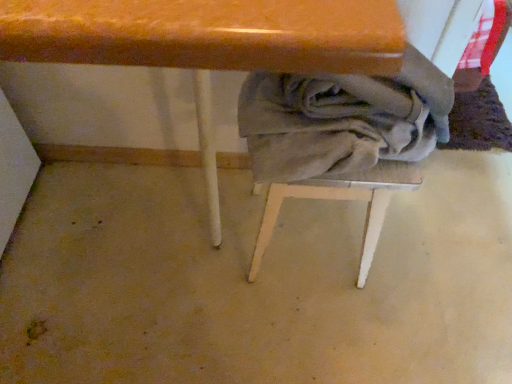
Question: Does gray cotton laundry at lower center have a larger size compared to wooden table at center?

Choices:
 (A) no
 (B) yes

Answer: (A)

Question: Is gray cotton laundry at lower center not close to wooden table at center?

Choices:
 (A) yes
 (B) no

Answer: (B)

Question: Can you confirm if gray cotton laundry at lower center is smaller than wooden table at center?

Choices:
 (A) no
 (B) yes

Answer: (B)

Question: Can you confirm if gray cotton laundry at lower center is positioned to the right of wooden table at center?

Choices:
 (A) no
 (B) yes

Answer: (B)

Question: Is gray cotton laundry at lower center oriented towards wooden table at center?

Choices:
 (A) no
 (B) yes

Answer: (A)

Question: From the image's perspective, is gray cotton laundry at lower center on wooden table at center?

Choices:
 (A) no
 (B) yes

Answer: (B)

Question: Can you see gray fabric-covered stool at center touching gray cotton laundry at lower center?

Choices:
 (A) yes
 (B) no

Answer: (B)

Question: Is gray fabric-covered stool at center at the left side of gray cotton laundry at lower center?

Choices:
 (A) no
 (B) yes

Answer: (B)

Question: Can you confirm if gray fabric-covered stool at center is smaller than gray cotton laundry at lower center?

Choices:
 (A) no
 (B) yes

Answer: (A)

Question: Is gray fabric-covered stool at center outside of gray cotton laundry at lower center?

Choices:
 (A) no
 (B) yes

Answer: (B)

Question: Is gray fabric-covered stool at center positioned behind gray cotton laundry at lower center?

Choices:
 (A) yes
 (B) no

Answer: (A)

Question: Can you confirm if gray fabric-covered stool at center is thinner than gray cotton laundry at lower center?

Choices:
 (A) yes
 (B) no

Answer: (A)

Question: Can you confirm if gray fabric-covered stool at center is smaller than wooden table at center?

Choices:
 (A) no
 (B) yes

Answer: (B)